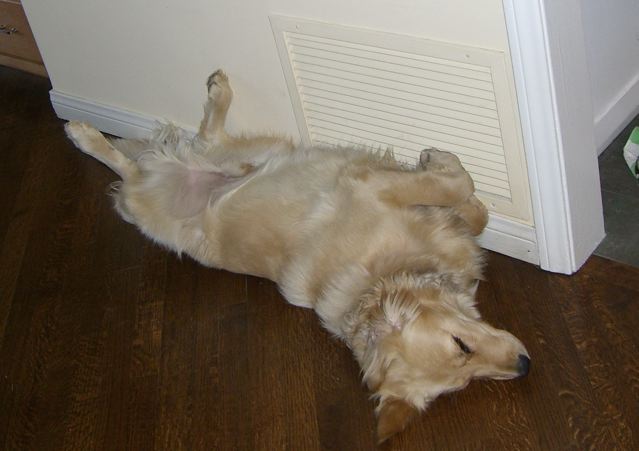
This screenshot has height=451, width=639. Find the location of `wall`. wall is located at coordinates (165, 43).